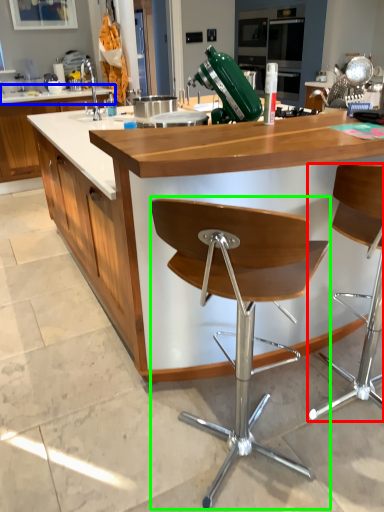
Question: Which object is positioned farthest from chair (highlighted by a red box)? Select from countertop (highlighted by a blue box) and chair (highlighted by a green box).

Choices:
 (A) countertop
 (B) chair

Answer: (A)